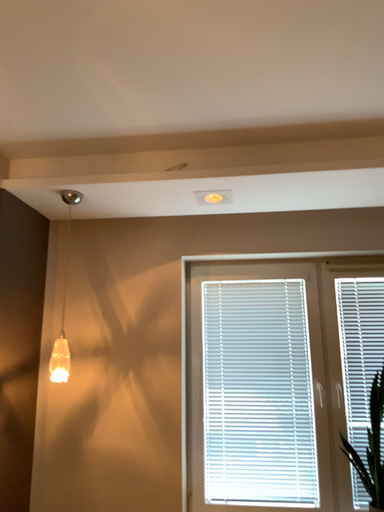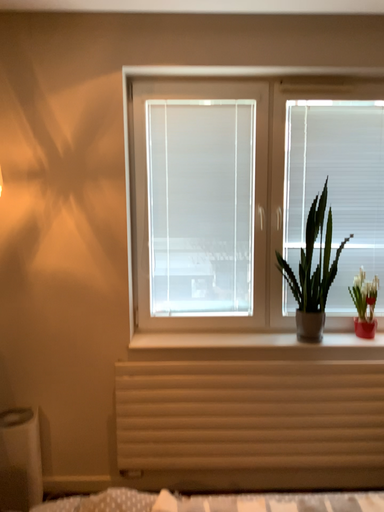
Question: How did the camera likely rotate when shooting the video?

Choices:
 (A) rotated right
 (B) rotated left

Answer: (A)